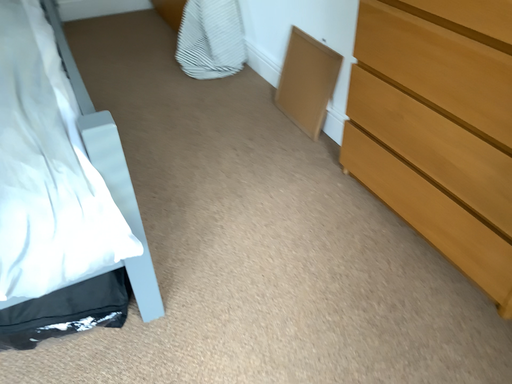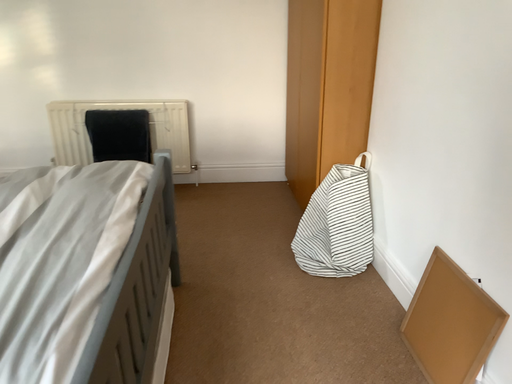
Question: How did the camera likely rotate when shooting the video?

Choices:
 (A) rotated right
 (B) rotated left

Answer: (B)